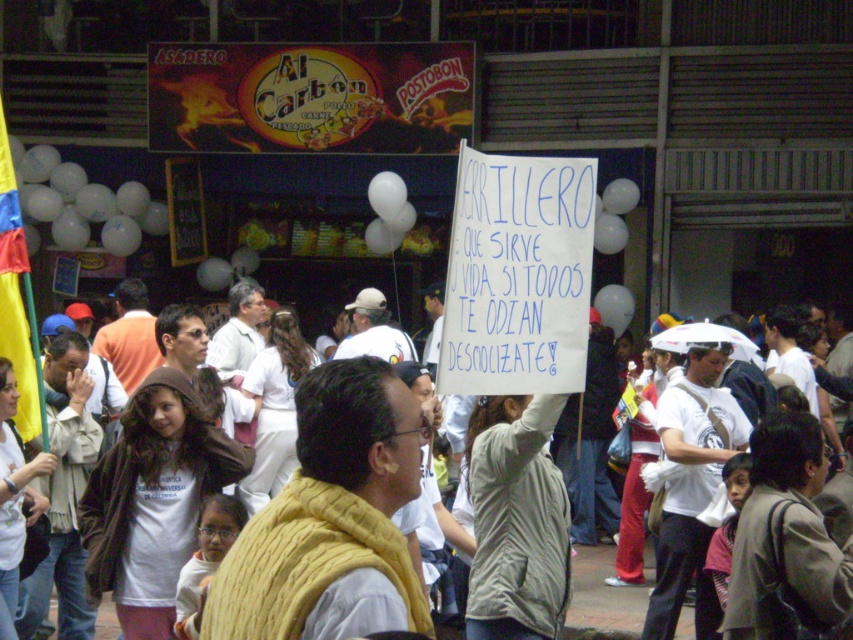
Find the location of a particular element. Image resolution: width=853 pixels, height=640 pixels. light brown leather jacket at left is located at coordinates [65, 490].

Is light brown leather jacket at left thinner than white matte baseball cap at center?

Yes.

Is point (48, 589) closer to camera compared to point (381, 296)?

Yes, point (48, 589) is in front of point (381, 296).

At what (x,y) coordinates should I click in order to perform the action: click on light brown leather jacket at left. Please return your answer as a coordinate pair (x, y). This screenshot has height=640, width=853. Looking at the image, I should click on (65, 490).

From the picture: Is white paper sign at upper center to the right of white matte shirt at center from the viewer's perspective?

In fact, white paper sign at upper center is to the left of white matte shirt at center.

Who is more forward, (583, 579) or (213, 362)?

Point (583, 579)

This screenshot has width=853, height=640. Find the location of `white paper sign at upper center`. white paper sign at upper center is located at coordinates (601, 600).

What do you see at coordinates (329, 516) in the screenshot?
I see `yellow knitted vest at center` at bounding box center [329, 516].

Is point (254, 570) positioned after point (361, 324)?

No.

At what (x,y) coordinates should I click in order to perform the action: click on yellow knitted vest at center. Please return your answer as a coordinate pair (x, y). Looking at the image, I should click on (329, 516).